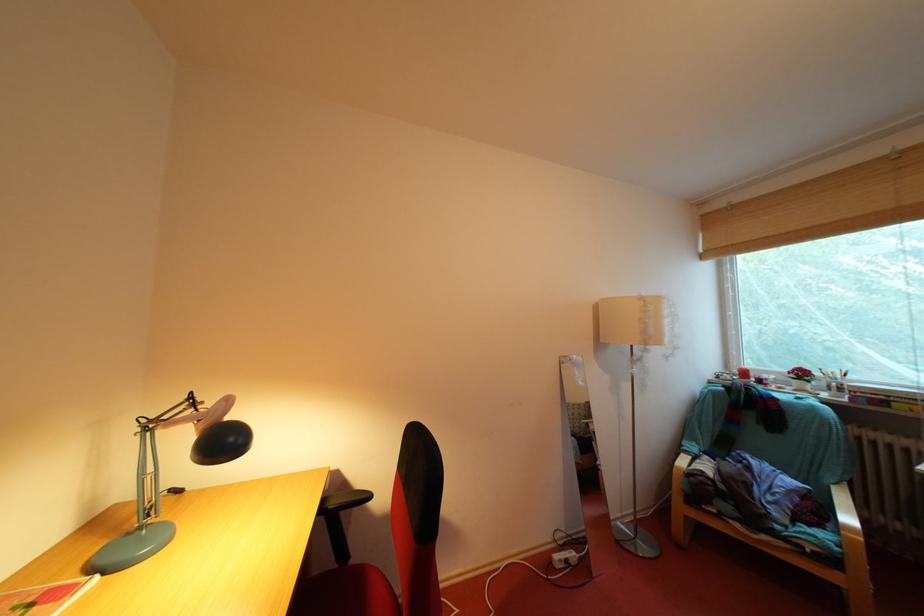
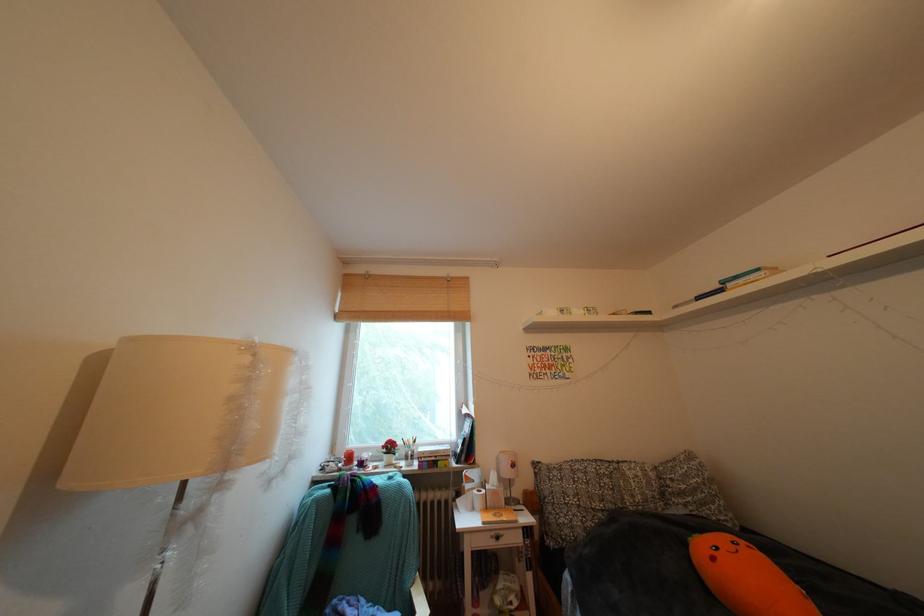
Where in the second image is the point corresponding to (x=743, y=213) from the first image?

(379, 282)